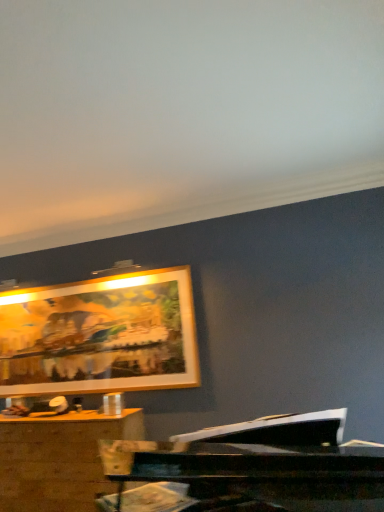
Question: Can you confirm if wooden desk at lower left is positioned to the right of gold-framed artwork at upper center?

Choices:
 (A) yes
 (B) no

Answer: (B)

Question: Is wooden desk at lower left aimed at gold-framed artwork at upper center?

Choices:
 (A) no
 (B) yes

Answer: (A)

Question: Considering the relative sizes of wooden desk at lower left and gold-framed artwork at upper center in the image provided, is wooden desk at lower left wider than gold-framed artwork at upper center?

Choices:
 (A) yes
 (B) no

Answer: (A)

Question: Is wooden desk at lower left placed right next to gold-framed artwork at upper center?

Choices:
 (A) no
 (B) yes

Answer: (A)

Question: Is wooden desk at lower left smaller than gold-framed artwork at upper center?

Choices:
 (A) no
 (B) yes

Answer: (A)

Question: Is wooden desk at lower left taller than gold-framed artwork at upper center?

Choices:
 (A) yes
 (B) no

Answer: (B)

Question: Is gold-framed artwork at upper center far away from wooden desk at lower left?

Choices:
 (A) no
 (B) yes

Answer: (A)

Question: Considering the relative sizes of gold-framed artwork at upper center and wooden desk at lower left in the image provided, is gold-framed artwork at upper center smaller than wooden desk at lower left?

Choices:
 (A) no
 (B) yes

Answer: (B)

Question: Is gold-framed artwork at upper center closer to camera compared to wooden desk at lower left?

Choices:
 (A) no
 (B) yes

Answer: (A)

Question: Is gold-framed artwork at upper center positioned with its back to wooden desk at lower left?

Choices:
 (A) yes
 (B) no

Answer: (B)

Question: Does gold-framed artwork at upper center appear on the right side of wooden desk at lower left?

Choices:
 (A) yes
 (B) no

Answer: (A)

Question: Can you confirm if gold-framed artwork at upper center is wider than wooden desk at lower left?

Choices:
 (A) no
 (B) yes

Answer: (A)

Question: Considering the positions of wooden desk at lower left and gold-framed artwork at upper center in the image, is wooden desk at lower left bigger or smaller than gold-framed artwork at upper center?

Choices:
 (A) small
 (B) big

Answer: (B)